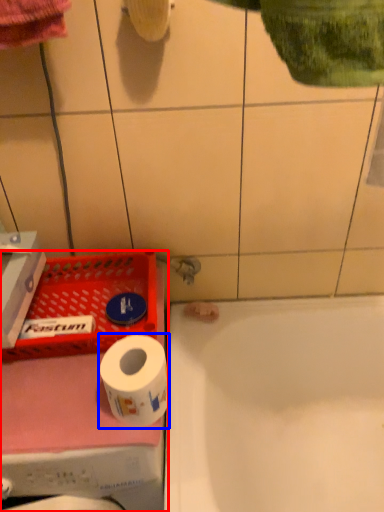
Question: Among these objects, which one is farthest to the camera, washing machine (highlighted by a red box) or toilet paper (highlighted by a blue box)?

Choices:
 (A) washing machine
 (B) toilet paper

Answer: (B)